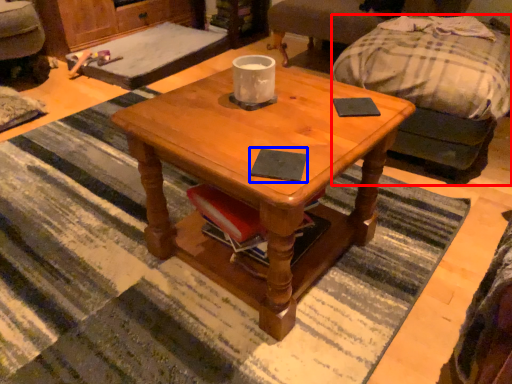
Question: Which object is further to the camera taking this photo, studio couch (highlighted by a red box) or pad (highlighted by a blue box)?

Choices:
 (A) studio couch
 (B) pad

Answer: (A)